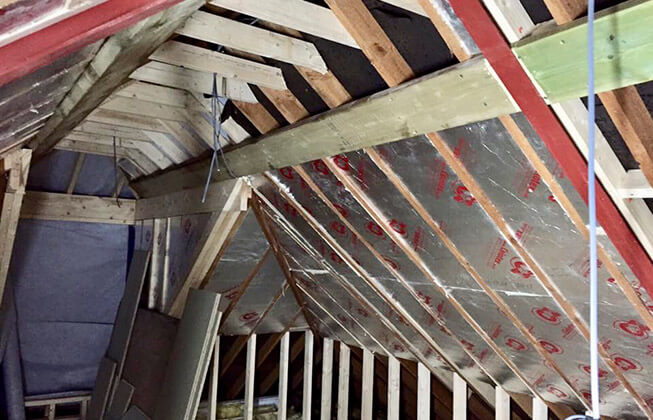
At what (x,y) coordinates should I click in order to perform the action: click on lgiht brown beams. Please return your answer as a coordinate pair (x, y). The width and height of the screenshot is (653, 420). Looking at the image, I should click on (300, 17), (290, 48), (270, 71).